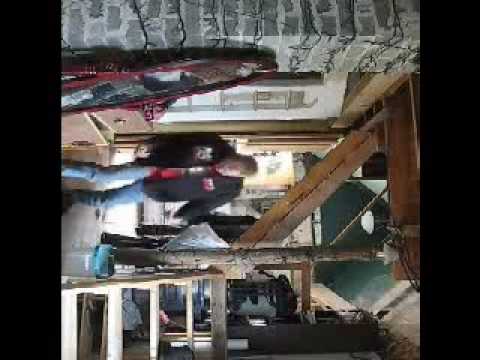
The image size is (480, 360). I want to click on ceiling, so pos(376,286).